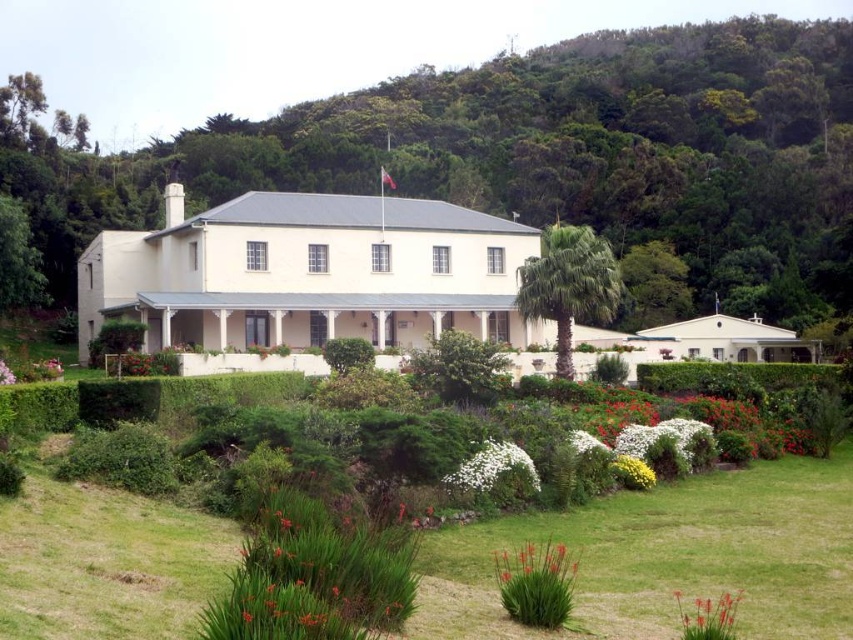
You are planning to plant a new flower bed in the garden of the two story building. You have two flowers to choose from, the pink matte flower at lower left and the white matte flower at lower left. If you want to use the flower that takes up more space, which one should you choose?

The white matte flower at lower left takes up more space than the pink matte flower at lower left, so you should choose the white matte flower at lower left.